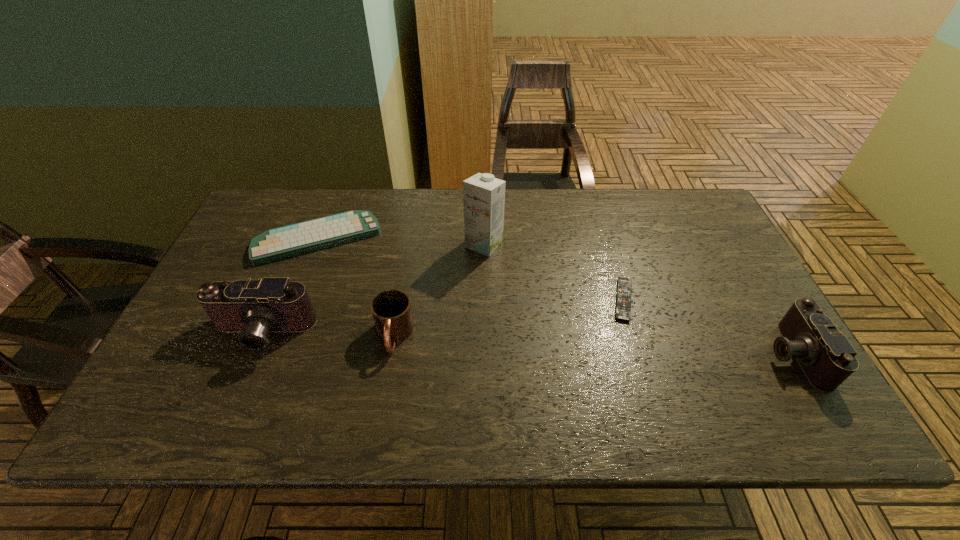
This screenshot has width=960, height=540. What are the coordinates of `camera that is at the left edge` in the screenshot? It's located at (254, 308).

Find the location of `computer keyboard that is at the left edge`. computer keyboard that is at the left edge is located at coordinates (287, 241).

What are the coordinates of `object that is at the right edge` in the screenshot? It's located at (826, 356).

Locate an element on the screen. object located at the far left corner is located at coordinates (287, 241).

This screenshot has height=540, width=960. I want to click on object at the near left corner, so click(x=254, y=308).

The image size is (960, 540). What are the coordinates of `object that is at the near right corner` in the screenshot? It's located at (826, 356).

Where is `free space at the far edge`? The height and width of the screenshot is (540, 960). free space at the far edge is located at coordinates (538, 198).

In order to click on vacant space at the near edge of the desktop in this screenshot , I will do `click(586, 365)`.

This screenshot has height=540, width=960. In order to click on free space at the right edge of the desktop in this screenshot , I will do `click(727, 321)`.

Where is `free space at the far left corner of the desktop`? This screenshot has width=960, height=540. free space at the far left corner of the desktop is located at coordinates (253, 214).